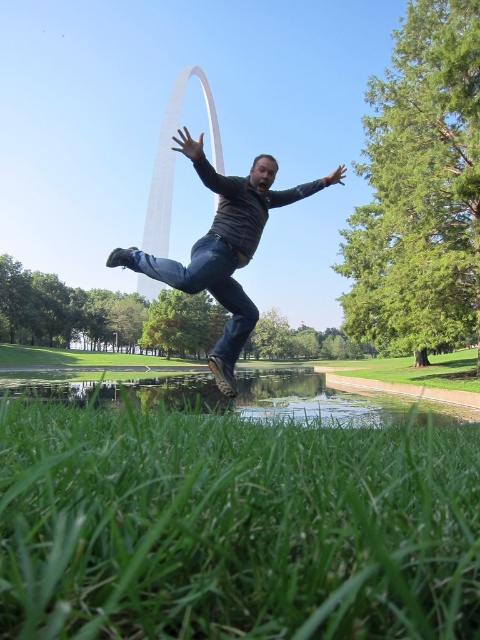
From the picture: You are standing in the park and see the green grass at lower center and the denim at center. Which object is nearer to you?

The green grass at lower center is closer to the viewer than the denim at center.

You are a photographer trying to capture the Gateway Arch in the background while focusing on the person jumping. Which object, the green grass at lower center or the matte black arm at center, should you adjust your focus to ensure the arch is visible behind the person?

The green grass at lower center is in front of the matte black arm at center. To ensure the Gateway Arch in the background is visible behind the person, you should focus on the matte black arm at center since it is farther back, allowing the arch to be in the background layer.

You are standing on the green grass at lower center and want to jump to the denim at center. Can you reach it in one jump if your maximum jump distance is 7 feet?

The green grass at lower center is 7.71 feet away from denim at center. Since your maximum jump distance is 7 feet, you cannot reach the denim at center in one jump.